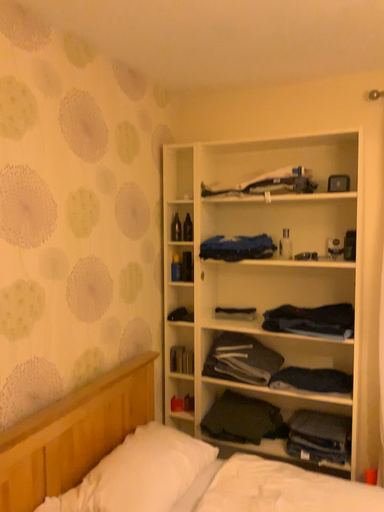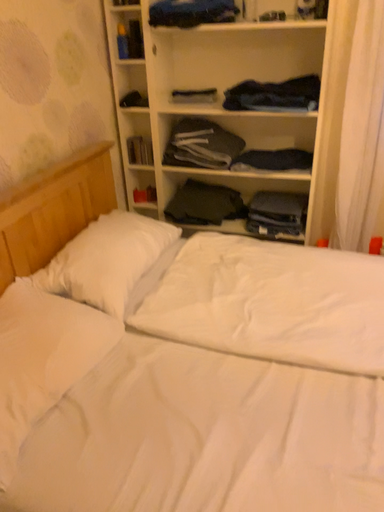
Question: How did the camera likely rotate when shooting the video?

Choices:
 (A) rotated downward
 (B) rotated upward

Answer: (A)